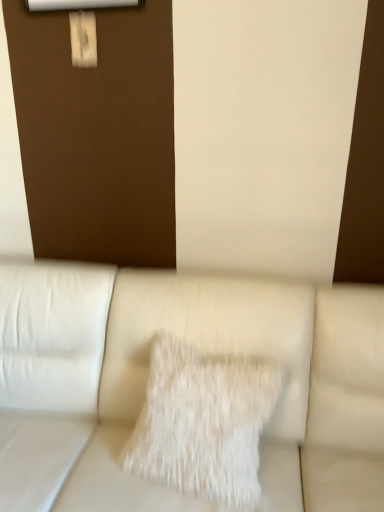
Question: Looking at their shapes, would you say white leather couch at center is wider or thinner than white fluffy pillow at center?

Choices:
 (A) wide
 (B) thin

Answer: (A)

Question: Is white leather couch at center inside or outside of white fluffy pillow at center?

Choices:
 (A) inside
 (B) outside

Answer: (B)

Question: Considering the relative positions of white leather couch at center and white fluffy pillow at center in the image provided, is white leather couch at center to the left or to the right of white fluffy pillow at center?

Choices:
 (A) right
 (B) left

Answer: (B)

Question: From a real-world perspective, is white fluffy pillow at center positioned above or below white leather couch at center?

Choices:
 (A) below
 (B) above

Answer: (B)

Question: In the image, is white fluffy pillow at center on the left side or the right side of white leather couch at center?

Choices:
 (A) left
 (B) right

Answer: (B)

Question: From the image's perspective, relative to white leather couch at center, is white fluffy pillow at center above or below?

Choices:
 (A) below
 (B) above

Answer: (B)

Question: Considering their positions, is white fluffy pillow at center located in front of or behind white leather couch at center?

Choices:
 (A) behind
 (B) front

Answer: (A)